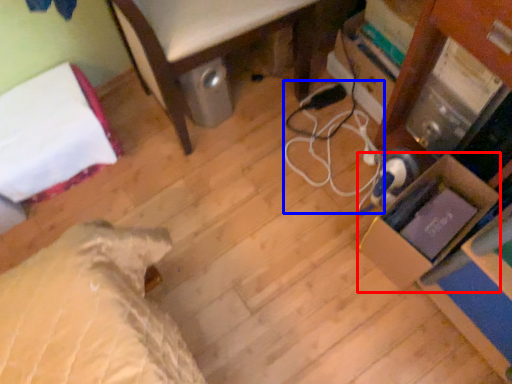
Question: Which object is further to the camera taking this photo, cardboard box (highlighted by a red box) or cable (highlighted by a blue box)?

Choices:
 (A) cardboard box
 (B) cable

Answer: (B)